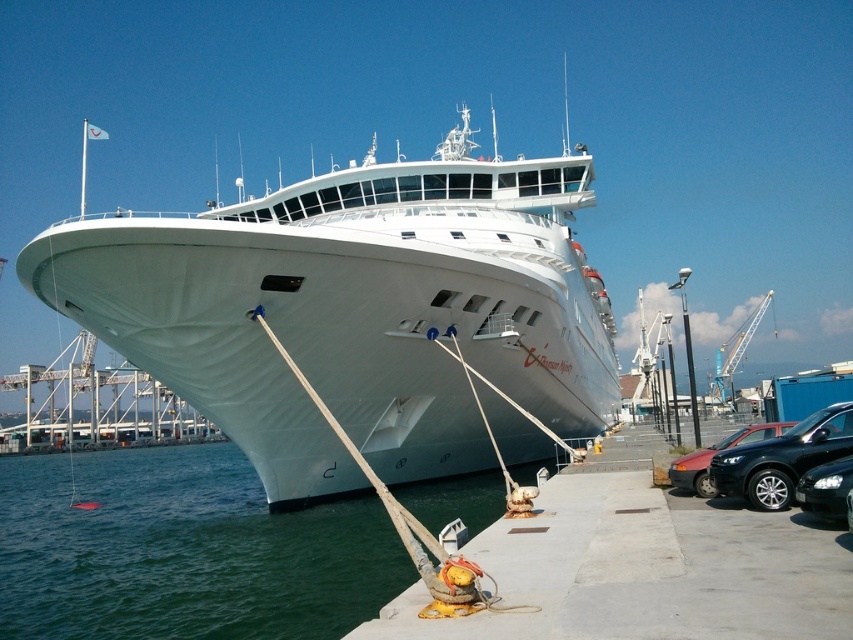
Describe the element at coordinates (357, 310) in the screenshot. I see `white glossy cruise ship at center` at that location.

Which is in front, point (479, 170) or point (801, 449)?

Point (801, 449)

Is point (163, 260) closer to camera compared to point (770, 493)?

No.

Where is `white glossy cruise ship at center`? white glossy cruise ship at center is located at coordinates (357, 310).

Is matte black car at lower right to the left of black glossy sedan at lower right from the viewer's perspective?

No, matte black car at lower right is not to the left of black glossy sedan at lower right.

Who is more distant from viewer, (781, 433) or (827, 488)?

The point (781, 433) is behind.

Which is behind, point (694, 484) or point (834, 508)?

Point (694, 484)

The height and width of the screenshot is (640, 853). What are the coordinates of `matte black car at lower right` in the screenshot? It's located at (714, 452).

Which of these two, black glossy car at lower right or black glossy sedan at lower right, stands taller?

black glossy car at lower right is taller.

Can you confirm if black glossy car at lower right is taller than black glossy sedan at lower right?

Yes.

Image resolution: width=853 pixels, height=640 pixels. I want to click on black glossy car at lower right, so click(782, 458).